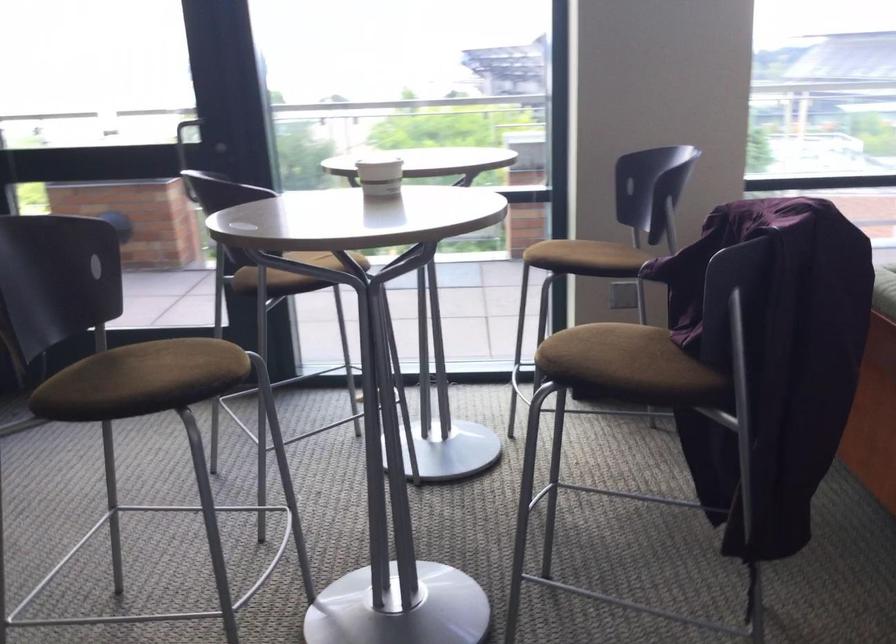
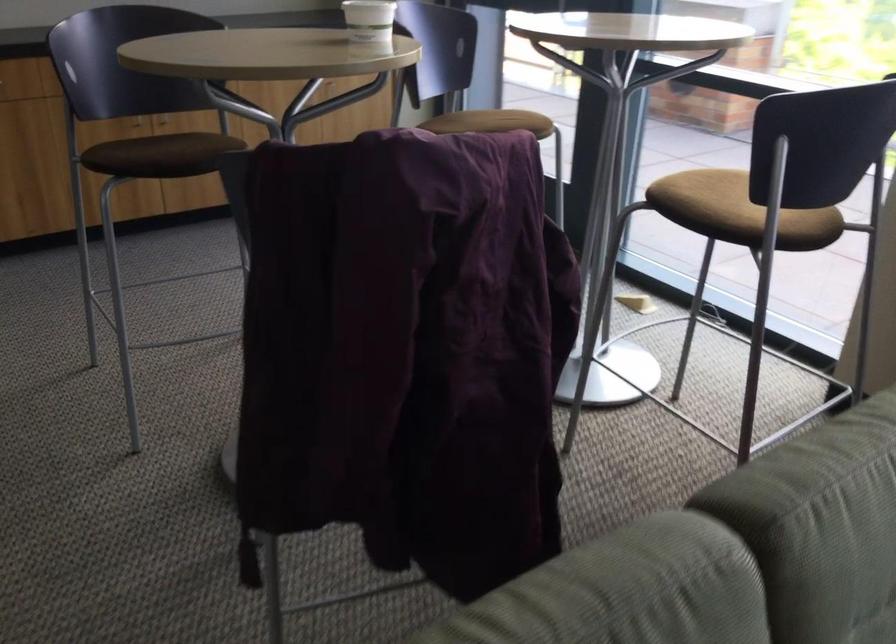
Locate, in the second image, the point that corresponds to (x=220, y=375) in the first image.

(173, 160)